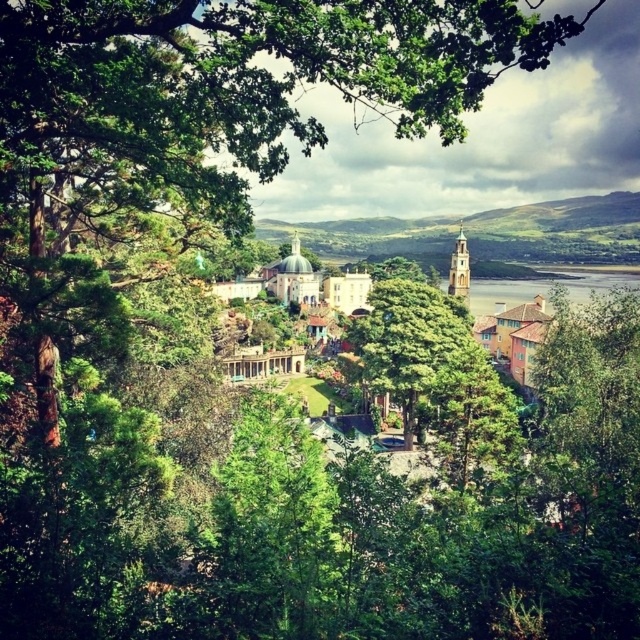
Question: Which of the following is the closest to the observer?

Choices:
 (A) green leafy tree at center
 (B) clear water at lower right

Answer: (A)

Question: Where is green leafy tree at center located in relation to clear water at lower right in the image?

Choices:
 (A) above
 (B) below

Answer: (B)

Question: Is green leafy tree at center wider than clear water at lower right?

Choices:
 (A) yes
 (B) no

Answer: (B)

Question: From the image, what is the correct spatial relationship of green leafy tree at center in relation to clear water at lower right?

Choices:
 (A) above
 (B) below

Answer: (B)